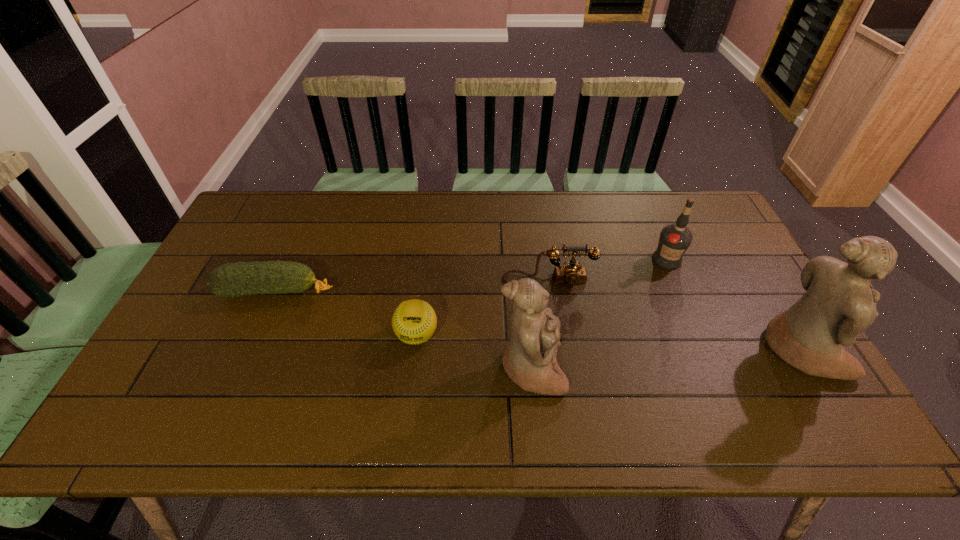
Where is `vacant space situated 0.130m on the front-facing side of the fifth shortest object`? Image resolution: width=960 pixels, height=540 pixels. vacant space situated 0.130m on the front-facing side of the fifth shortest object is located at coordinates (618, 369).

At what (x,y) coordinates should I click in order to perform the action: click on free space located 0.130m on the front label of the vodka. Please return your answer as a coordinate pair (x, y). Looking at the image, I should click on (685, 303).

Where is `vacant space located at the blossom end of the leftmost object`? The width and height of the screenshot is (960, 540). vacant space located at the blossom end of the leftmost object is located at coordinates (375, 292).

The height and width of the screenshot is (540, 960). I want to click on vacant space located on the logo side of the second object from left to right, so click(410, 393).

Find the location of `vacant point located 0.060m on the front-facing side of the telephone`. vacant point located 0.060m on the front-facing side of the telephone is located at coordinates (553, 302).

Find the location of a particular element. This screenshot has width=960, height=540. object at the left edge is located at coordinates (238, 279).

Locate an element on the screen. object present at the right edge is located at coordinates (839, 303).

Locate an element on the screen. The height and width of the screenshot is (540, 960). object present at the near right corner is located at coordinates (839, 303).

In the image, there is a desktop. At what (x,y) coordinates should I click in order to perform the action: click on vacant region at the far edge. Please return your answer as a coordinate pair (x, y). The image size is (960, 540). Looking at the image, I should click on (543, 222).

I want to click on vacant space at the near edge of the desktop, so click(x=482, y=372).